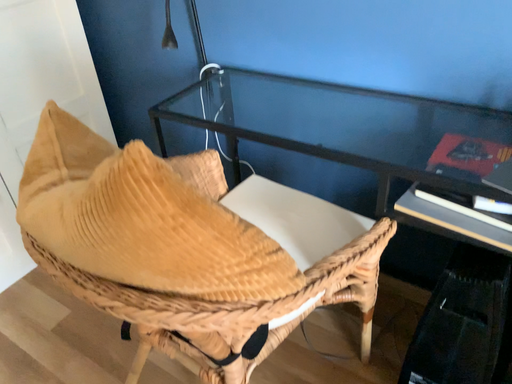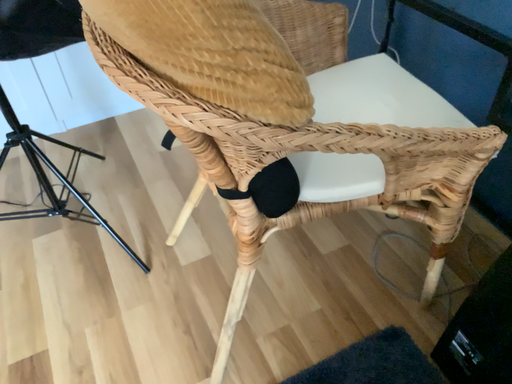
Question: Which way did the camera rotate in the video?

Choices:
 (A) rotated left
 (B) rotated right

Answer: (A)